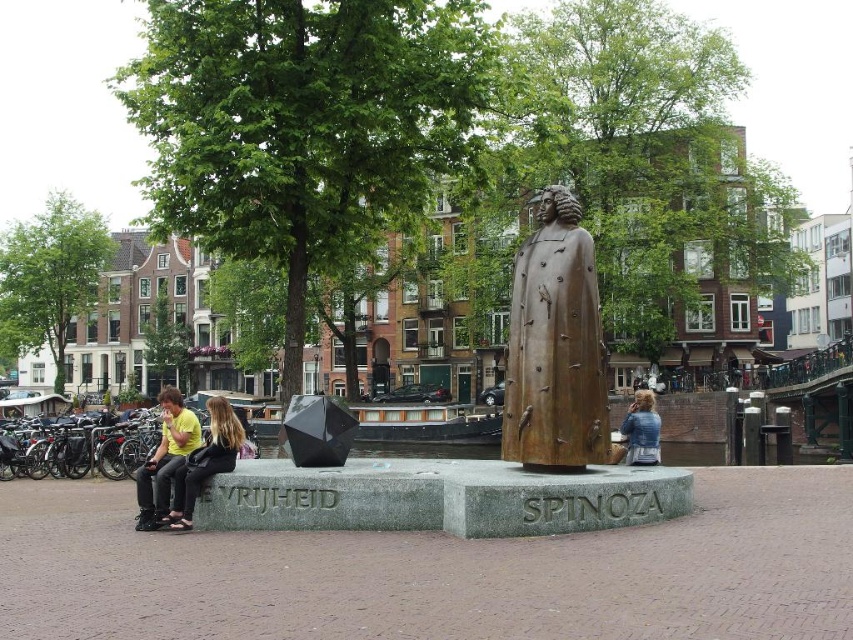
Question: Is matte black jacket at lower left smaller than blue denim jacket at lower right?

Choices:
 (A) no
 (B) yes

Answer: (B)

Question: Which object appears closest to the camera in this image?

Choices:
 (A) matte black jacket at lower left
 (B) blue denim jacket at lower right

Answer: (A)

Question: Is bronze statue at center behind blue denim jacket at lower right?

Choices:
 (A) no
 (B) yes

Answer: (A)

Question: Does bronze statue at center appear on the right side of blue denim jacket at lower right?

Choices:
 (A) yes
 (B) no

Answer: (B)

Question: Which point is closer to the camera taking this photo?

Choices:
 (A) (231, 426)
 (B) (646, 422)
 (C) (170, 410)
 (D) (550, 355)

Answer: (D)

Question: Which object is the farthest from the bronze statue at center?

Choices:
 (A) blue denim jacket at lower right
 (B) matte black jacket at lower left

Answer: (B)